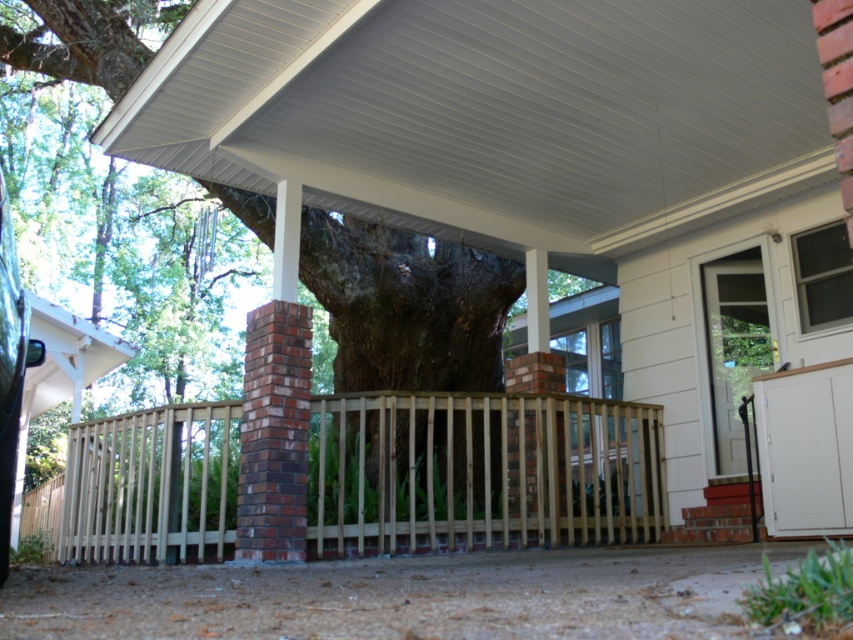
Question: Can you confirm if white corrugated metal roof at upper center is wider than light brown wooden fence at center?

Choices:
 (A) yes
 (B) no

Answer: (B)

Question: Which point is closer to the camera?

Choices:
 (A) (810, 128)
 (B) (155, 522)

Answer: (A)

Question: Which point is farther to the camera?

Choices:
 (A) pos(548,515)
 (B) pos(440,88)

Answer: (A)

Question: Can you confirm if white corrugated metal roof at upper center is bigger than light brown wooden fence at center?

Choices:
 (A) yes
 (B) no

Answer: (B)

Question: Which object appears closest to the camera in this image?

Choices:
 (A) light brown wooden fence at center
 (B) white corrugated metal roof at upper center

Answer: (B)

Question: Is white corrugated metal roof at upper center wider than light brown wooden fence at center?

Choices:
 (A) no
 (B) yes

Answer: (A)